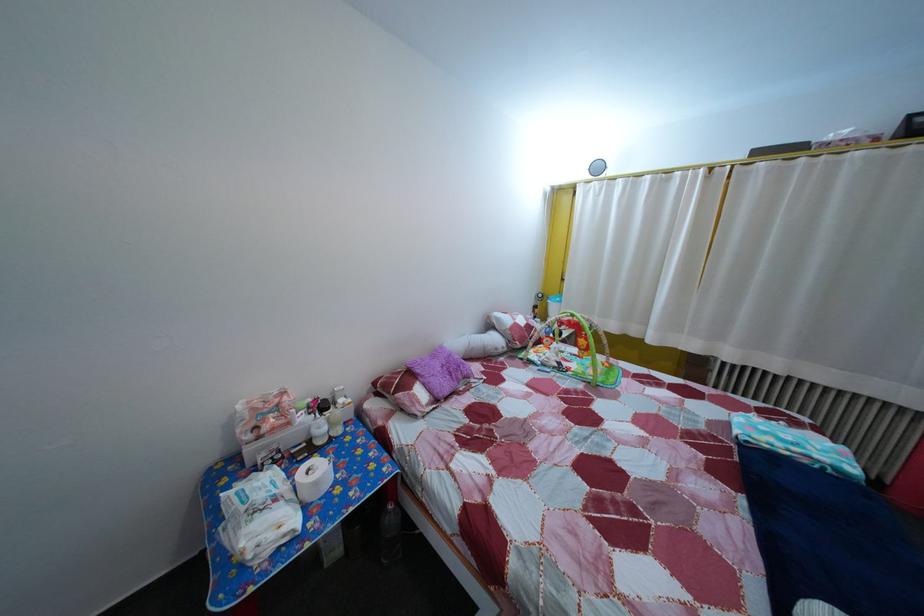
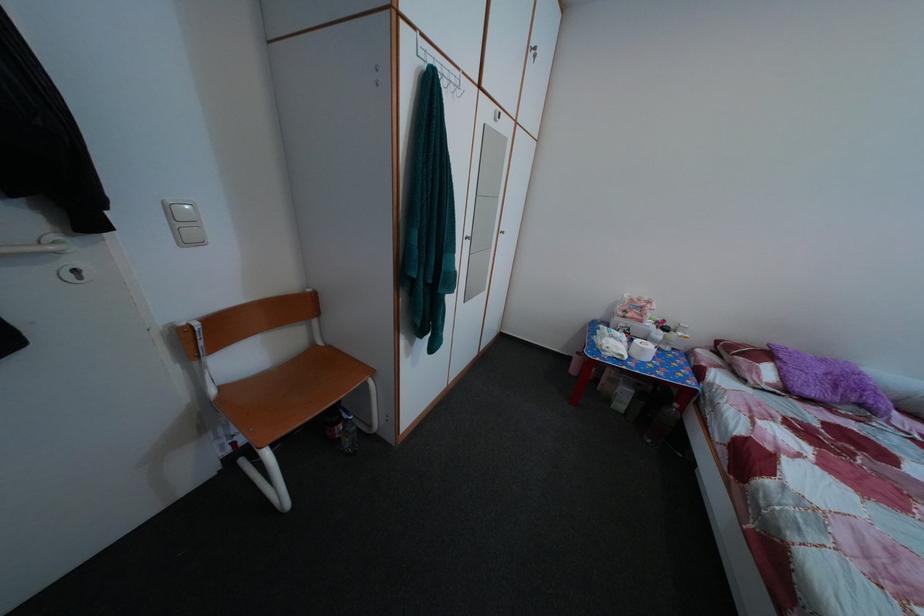
Based on the continuous images, in which direction is the camera rotating?

The rotation direction of the camera is left-down.